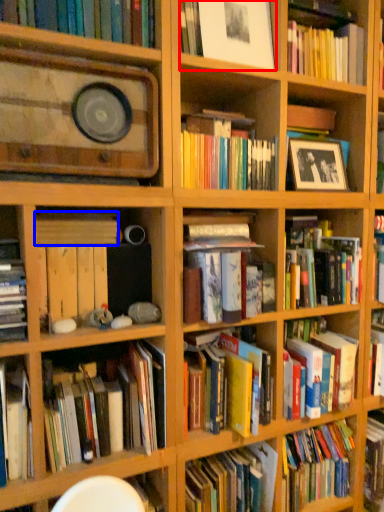
Question: Among these objects, which one is nearest to the camera, book (highlighted by a red box) or book (highlighted by a blue box)?

Choices:
 (A) book
 (B) book

Answer: (B)